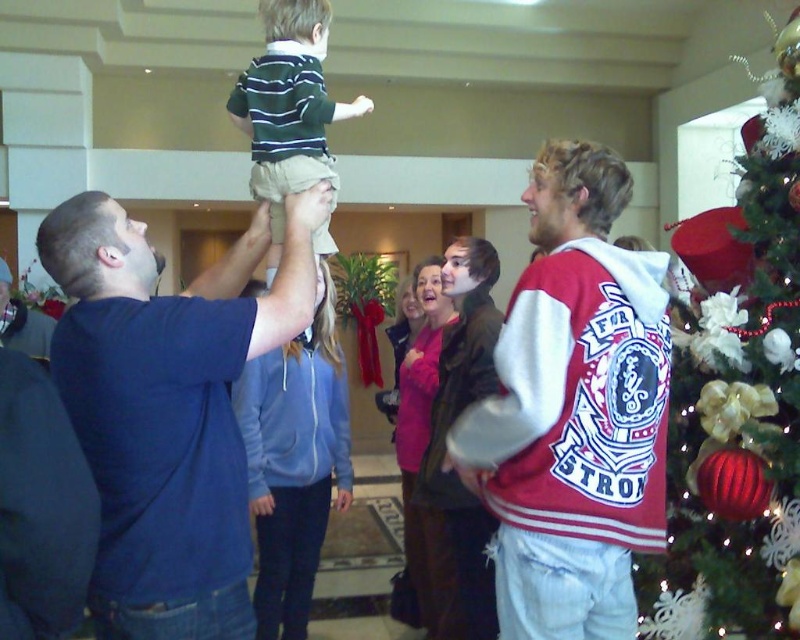
Question: Can you confirm if maroon velvety jacket at center is positioned to the right of shiny red ornaments at right?

Choices:
 (A) no
 (B) yes

Answer: (A)

Question: Where is dark blue t-shirt at upper left located in relation to striped knit sweater at upper center in the image?

Choices:
 (A) right
 (B) left

Answer: (B)

Question: Is maroon velvety jacket at center to the left of striped knit sweater at upper center from the viewer's perspective?

Choices:
 (A) yes
 (B) no

Answer: (B)

Question: Which is farther from the shiny red ornaments at right?

Choices:
 (A) striped knit sweater at upper center
 (B) dark blue t-shirt at upper left

Answer: (B)

Question: Which object appears closest to the camera in this image?

Choices:
 (A) maroon velvety jacket at center
 (B) shiny red ornaments at right

Answer: (A)

Question: Which point is farther to the camera?

Choices:
 (A) dark blue t-shirt at upper left
 (B) shiny red ornaments at right

Answer: (B)